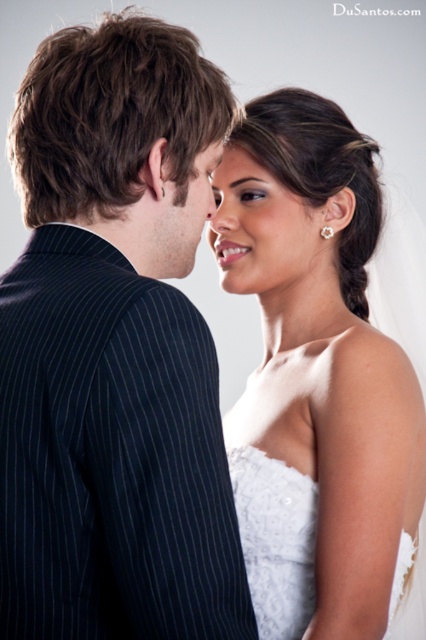
Can you confirm if white lace wedding dress at center is thinner than smooth skin forehead at upper center?

No.

Can you confirm if white lace wedding dress at center is wider than smooth skin forehead at upper center?

Yes, white lace wedding dress at center is wider than smooth skin forehead at upper center.

Image resolution: width=426 pixels, height=640 pixels. Describe the element at coordinates (276, 540) in the screenshot. I see `white lace wedding dress at center` at that location.

This screenshot has height=640, width=426. In order to click on white lace wedding dress at center in this screenshot , I will do `click(276, 540)`.

Is point (201, 209) less distant than point (311, 294)?

Yes, it is in front of point (311, 294).

Is dark blue pinstripe suit at left bigger than smooth skin face at center?

Indeed, dark blue pinstripe suit at left has a larger size compared to smooth skin face at center.

Who is more distant from viewer, (147,540) or (221,243)?

The point (221,243) is more distant.

The width and height of the screenshot is (426, 640). What are the coordinates of `dark blue pinstripe suit at left` in the screenshot? It's located at (115, 348).

Is white lace dress at right bigger than smooth skin face at center?

Correct, white lace dress at right is larger in size than smooth skin face at center.

Find the location of a particular element. The width and height of the screenshot is (426, 640). white lace dress at right is located at coordinates (319, 385).

The image size is (426, 640). I want to click on white lace dress at right, so click(x=319, y=385).